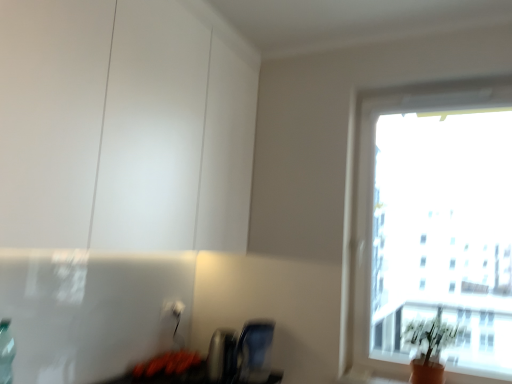
Question: From the image's perspective, is matte blue swivel chair at lower center above or below transparent glass window at upper right?

Choices:
 (A) above
 (B) below

Answer: (B)

Question: In terms of size, does matte blue swivel chair at lower center appear bigger or smaller than transparent glass window at upper right?

Choices:
 (A) big
 (B) small

Answer: (B)

Question: Which of these objects is positioned closest to the green matte plant at lower right?

Choices:
 (A) white plastic electric outlet at lower center, the second electric outlet in the left-to-right sequence
 (B) matte white cabinet at upper left
 (C) white plastic electric outlet at lower center, which is the first electric outlet in left-to-right order
 (D) transparent glass window at upper right
 (E) matte blue swivel chair at lower center

Answer: (E)

Question: Estimate the real-world distances between objects in this image. Which object is closer to the matte blue swivel chair at lower center?

Choices:
 (A) matte white cabinet at upper left
 (B) transparent glass window at upper right
 (C) white plastic electric outlet at lower center, which is the first electric outlet in left-to-right order
 (D) green matte plant at lower right
 (E) white plastic electric outlet at lower center, the second electric outlet in the left-to-right sequence

Answer: (C)